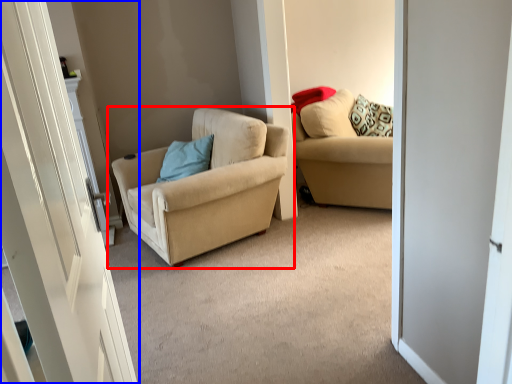
Question: Among these objects, which one is farthest to the camera, chair (highlighted by a red box) or door (highlighted by a blue box)?

Choices:
 (A) chair
 (B) door

Answer: (A)